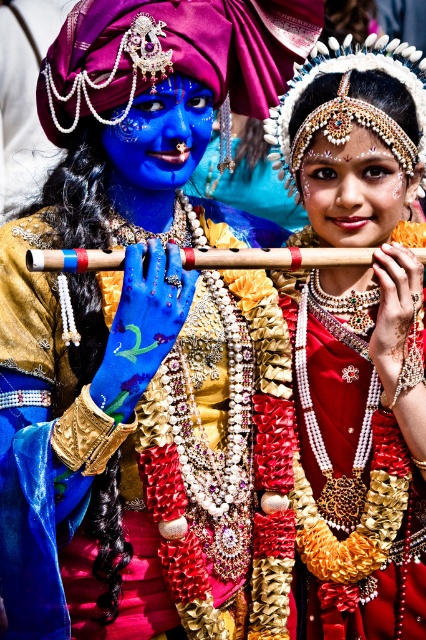
Which is in front, point (238, 3) or point (114, 172)?

Point (114, 172) is more forward.

Is purple satin turban at upper left taller than blue matte face at center?

No, purple satin turban at upper left is not taller than blue matte face at center.

Who is more distant from viewer, (262, 52) or (175, 177)?

Point (262, 52)

In order to click on purple satin turban at upper left in this screenshot , I will do `click(172, 54)`.

Does point (108, 16) come closer to viewer compared to point (389, 182)?

That is True.

The height and width of the screenshot is (640, 426). I want to click on purple satin turban at upper left, so click(172, 54).

This screenshot has height=640, width=426. I want to click on purple satin turban at upper left, so click(172, 54).

Can you confirm if purple satin turban at upper left is positioned above shiny gold fabric at center?

Yes.

Who is more forward, (230, 44) or (25, 276)?

Point (25, 276) is more forward.

You are a GUI agent. You are given a task and a screenshot of the screen. Output one action in this format:
    pyautogui.click(x=<x>, y=<y>)
    Task: Click on the purple satin turban at upper left
    The width and height of the screenshot is (426, 640).
    Given the screenshot: What is the action you would take?
    pyautogui.click(x=172, y=54)